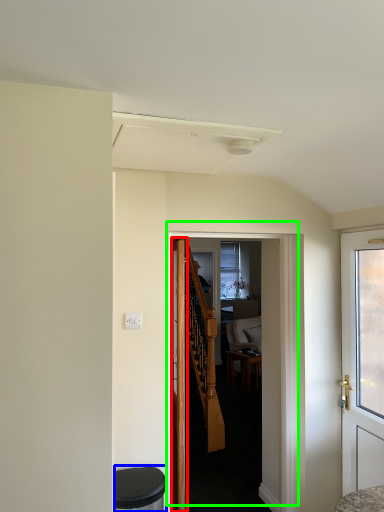
Question: Based on their relative distances, which object is farther from door (highlighted by a red box)? Choose from music stool (highlighted by a blue box) and door (highlighted by a green box).

Choices:
 (A) music stool
 (B) door

Answer: (A)